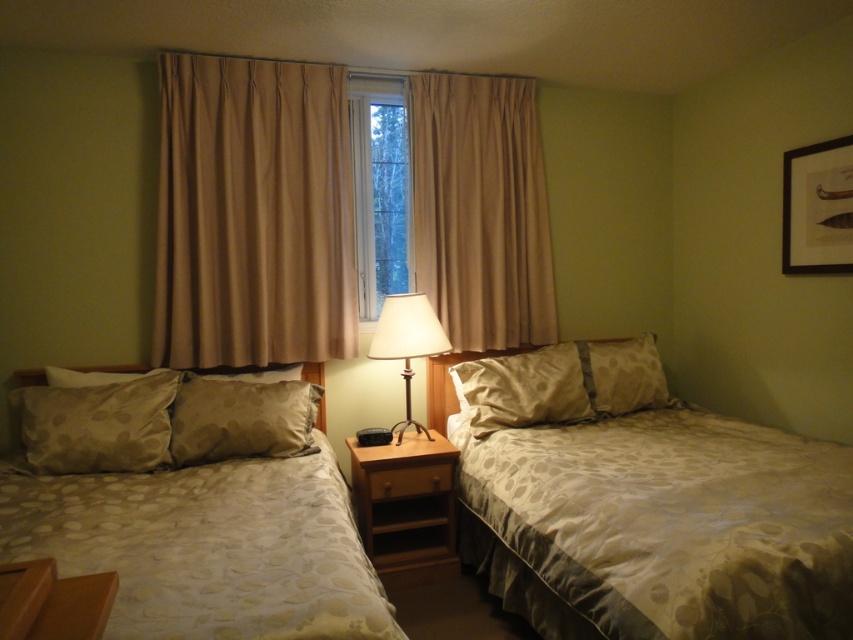
Based on the photo, you are standing at the point marked as point (212, 268) in the bedroom. You need to reach both twin beds positioned side by side against the light green wall. Which bed should you walk towards first to minimize the total distance you walk?

Since the twin beds are positioned side by side and the point is equidistant to both, you can choose either bed first as the total distance will be the same.